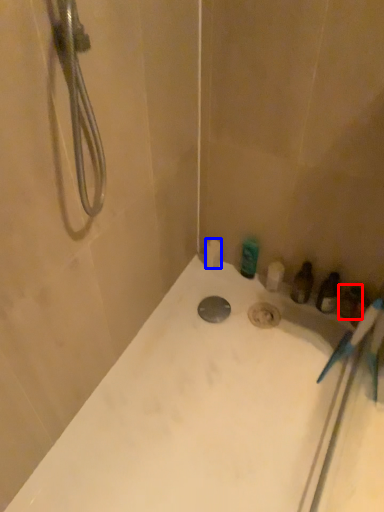
Question: Which point is further to the camera, toiletry (highlighted by a red box) or toilet paper (highlighted by a blue box)?

Choices:
 (A) toiletry
 (B) toilet paper

Answer: (B)